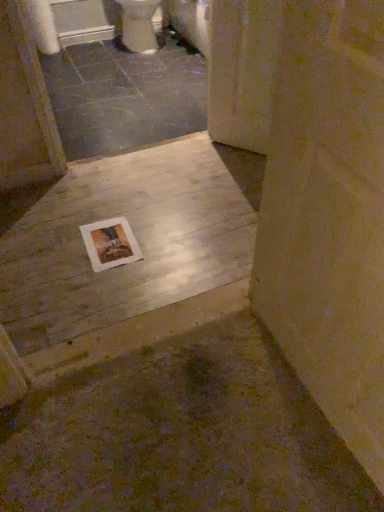
Find the location of a particular element. The image size is (384, 512). vacant area on top of white paper at center (from a real-world perspective) is located at coordinates (108, 240).